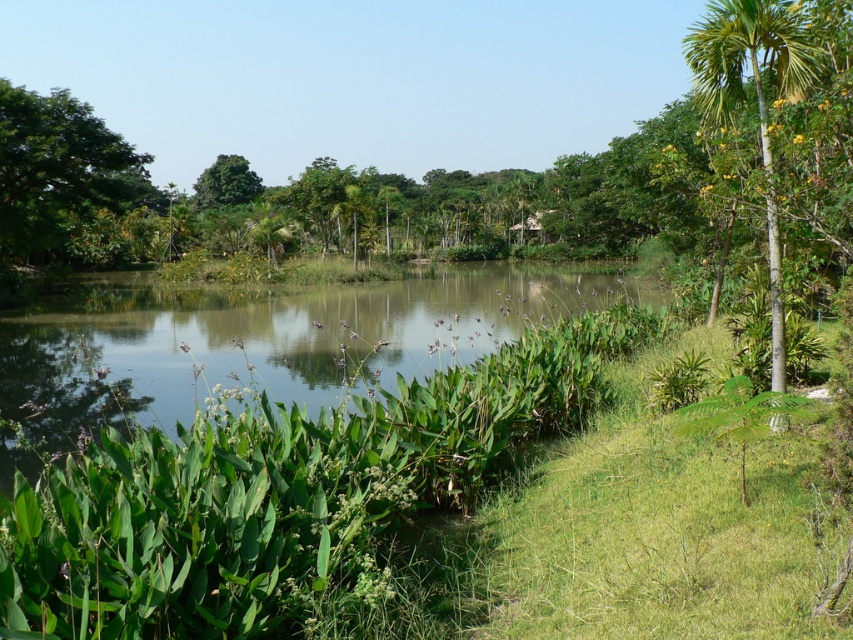
Does green leafy palm tree at right appear under green leafy tree at upper center?

Correct, green leafy palm tree at right is located below green leafy tree at upper center.

Describe the element at coordinates (756, 100) in the screenshot. The height and width of the screenshot is (640, 853). I see `green leafy palm tree at right` at that location.

Describe the element at coordinates (756, 100) in the screenshot. I see `green leafy palm tree at right` at that location.

Find the location of a particular element. The height and width of the screenshot is (640, 853). green leafy palm tree at right is located at coordinates (756, 100).

Does green leafy river at center have a larger size compared to green leafy palm tree at right?

Correct, green leafy river at center is larger in size than green leafy palm tree at right.

In the scene shown: Does green leafy river at center appear under green leafy palm tree at right?

Yes.

You are a GUI agent. You are given a task and a screenshot of the screen. Output one action in this format:
    pyautogui.click(x=<x>, y=<y>)
    Task: Click on the green leafy river at center
    
    Given the screenshot: What is the action you would take?
    pyautogui.click(x=274, y=339)

Which is behind, point (25, 189) or point (242, 163)?

The point (242, 163) is more distant.

Between green leafy tree at upper left and green leafy tree at upper center, which one is positioned higher?

green leafy tree at upper center is higher up.

Between point (22, 88) and point (224, 186), which one is positioned behind?

Point (224, 186)

Locate an element on the screen. The image size is (853, 640). green leafy tree at upper left is located at coordinates (57, 172).